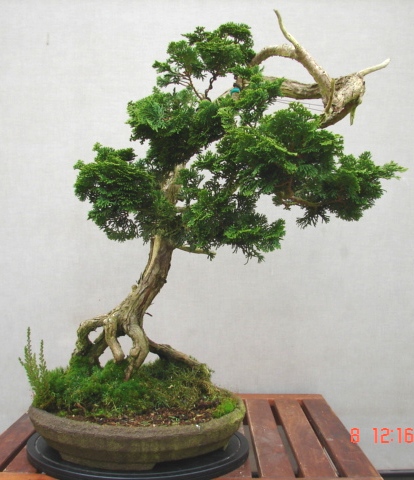
Locate an element on the screen. The image size is (414, 480). plate is located at coordinates (167, 469).